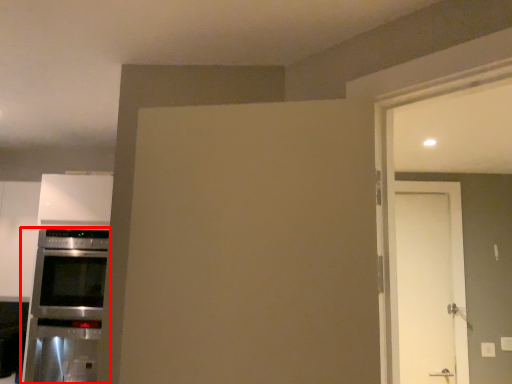
Question: From the image's perspective, what is the correct spatial positioning of home appliance (annotated by the red box) in reference to door?

Choices:
 (A) below
 (B) above

Answer: (A)